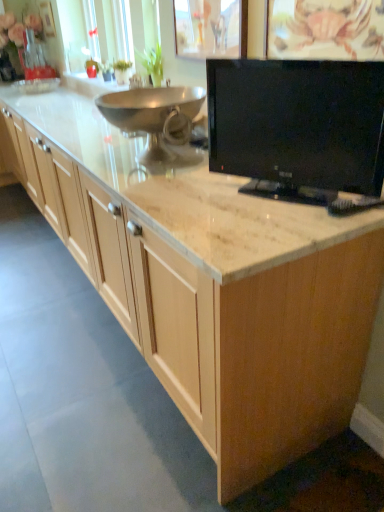
Question: From the image's perspective, is black glossy tv at upper right above or below polished stainless steel bowl at center?

Choices:
 (A) above
 (B) below

Answer: (B)

Question: Is black glossy tv at upper right taller or shorter than polished stainless steel bowl at center?

Choices:
 (A) short
 (B) tall

Answer: (B)

Question: Based on their relative distances, which object is farther from the satin nickel faucet at upper center?

Choices:
 (A) polished stainless steel bowl at center
 (B) black glossy tv at upper right

Answer: (B)

Question: Estimate the real-world distances between objects in this image. Which object is farther from the polished stainless steel bowl at center?

Choices:
 (A) black glossy tv at upper right
 (B) satin nickel faucet at upper center

Answer: (B)